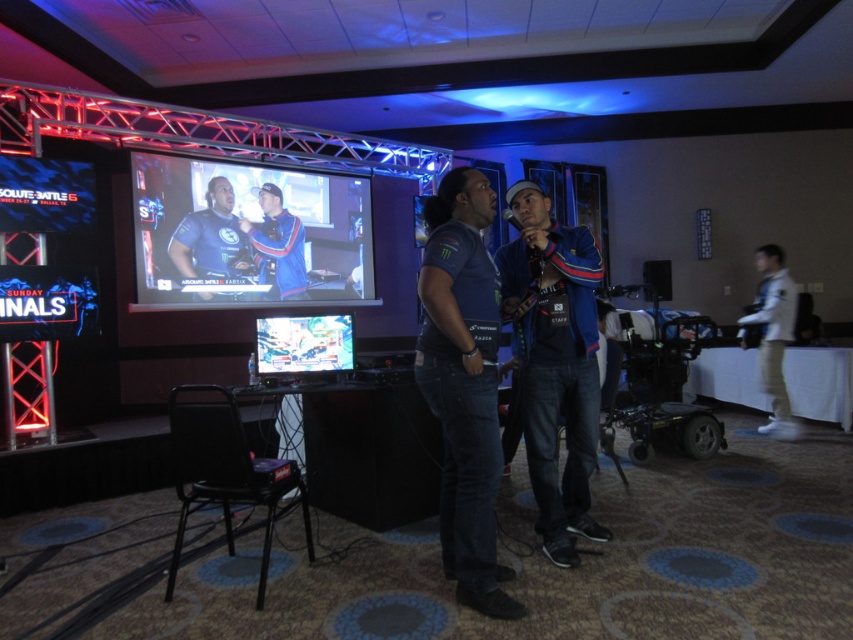
Question: Does shiny plastic monitor at center appear under blue jersey at center?

Choices:
 (A) yes
 (B) no

Answer: (A)

Question: Which is farther from the dark blue denim jeans at center?

Choices:
 (A) shiny plastic monitor at center
 (B) blue jersey at center
 (C) denim jacket at center
 (D) matte black monitor at center

Answer: (B)

Question: Is dark blue denim jeans at center behind denim jacket at center?

Choices:
 (A) no
 (B) yes

Answer: (A)

Question: Does matte black monitor at center have a lesser width compared to white cotton shirt at right?

Choices:
 (A) yes
 (B) no

Answer: (B)

Question: Which of the following is the closest to the observer?

Choices:
 (A) matte black monitor at center
 (B) blue jersey at center
 (C) denim jacket at center

Answer: (C)

Question: Which point is farther from the camera taking this photo?

Choices:
 (A) (440, 531)
 (B) (775, 364)
 (C) (543, 202)

Answer: (B)